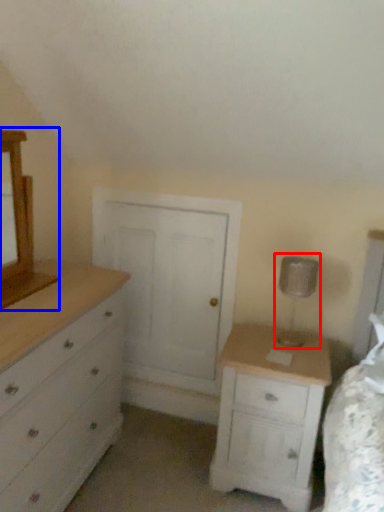
Question: Which of the following is the farthest to the observer, table lamp (highlighted by a red box) or medicine cabinet (highlighted by a blue box)?

Choices:
 (A) table lamp
 (B) medicine cabinet

Answer: (A)